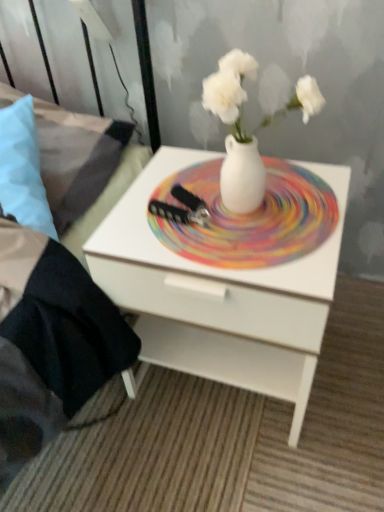
Locate an element on the screen. vacant area that is situated to the right of white matte vase at center is located at coordinates (322, 196).